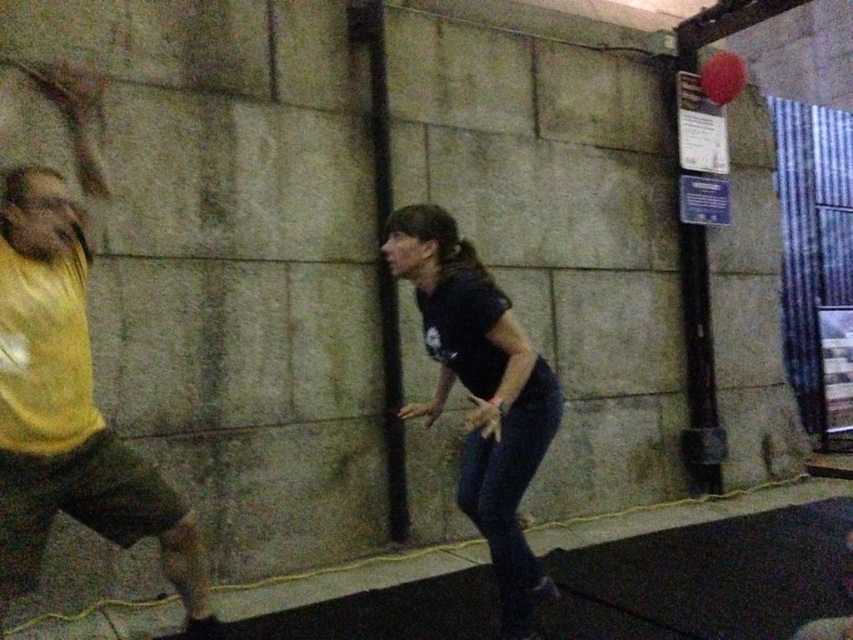
Question: Which point is farther from the camera taking this photo?

Choices:
 (A) (401, 252)
 (B) (68, 369)

Answer: (A)

Question: Which point is farther from the camera taking this photo?

Choices:
 (A) (0, 330)
 (B) (460, 284)

Answer: (B)

Question: Does yellow fabric shirt at left come behind black matte shirt at center?

Choices:
 (A) yes
 (B) no

Answer: (B)

Question: Does yellow fabric shirt at left have a larger size compared to black matte shirt at center?

Choices:
 (A) no
 (B) yes

Answer: (A)

Question: Can you confirm if yellow fabric shirt at left is wider than black matte shirt at center?

Choices:
 (A) no
 (B) yes

Answer: (A)